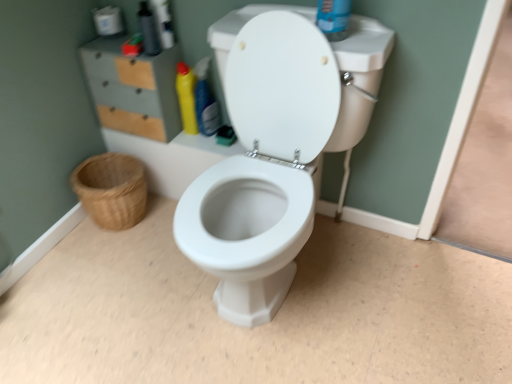
The image size is (512, 384). What do you see at coordinates (206, 101) in the screenshot?
I see `yellow glossy bottle at center, positioned as the 1th cleaning product in right-to-left order` at bounding box center [206, 101].

What do you see at coordinates (186, 97) in the screenshot? The height and width of the screenshot is (384, 512). I see `yellow plastic bottle at upper left, the 1th cleaning product viewed from the left` at bounding box center [186, 97].

This screenshot has width=512, height=384. In order to click on yellow plastic bottle at upper left, which is the 2th cleaning product in right-to-left order in this screenshot , I will do `click(186, 97)`.

Where is `translucent plastic bottle at upper left`? translucent plastic bottle at upper left is located at coordinates (148, 30).

From the picture: Measure the distance between white matte toilet paper at upper left and camera.

A distance of 4.91 feet exists between white matte toilet paper at upper left and camera.

Where is `woven natural basket at lower left`? This screenshot has height=384, width=512. woven natural basket at lower left is located at coordinates (112, 190).

Which of these two, white matte toilet paper at upper left or yellow glossy bottle at center, which is the 2th cleaning product in left-to-right order, is thinner?

yellow glossy bottle at center, which is the 2th cleaning product in left-to-right order, is thinner.

Which object is further away from the camera, white matte toilet paper at upper left or yellow glossy bottle at center, positioned as the 1th cleaning product in right-to-left order?

white matte toilet paper at upper left.

Would you say white matte toilet paper at upper left is outside yellow glossy bottle at center, which is the 2th cleaning product in left-to-right order?

white matte toilet paper at upper left lies outside yellow glossy bottle at center, which is the 2th cleaning product in left-to-right order,'s area.

From the image's perspective, which one is positioned higher, matte gray/file cabinet at upper left or yellow plastic bottle at upper left, the 1th cleaning product viewed from the left?

matte gray/file cabinet at upper left, from the image's perspective.

Is matte gray/file cabinet at upper left situated inside yellow plastic bottle at upper left, the 1th cleaning product viewed from the left, or outside?

matte gray/file cabinet at upper left lies outside yellow plastic bottle at upper left, the 1th cleaning product viewed from the left.

Consider the image. Which is further, (93, 68) or (187, 105)?

The point (187, 105) is farther from the camera.

Considering the points (201, 97) and (133, 89), which point is behind, point (201, 97) or point (133, 89)?

The point (201, 97) is more distant.

Measure the distance between yellow glossy bottle at center, which is the 2th cleaning product in left-to-right order, and matte gray/file cabinet at upper left.

yellow glossy bottle at center, which is the 2th cleaning product in left-to-right order, and matte gray/file cabinet at upper left are 8.41 inches apart.

From a real-world perspective, is yellow glossy bottle at center, which is the 2th cleaning product in left-to-right order, located higher than matte gray/file cabinet at upper left?

No, from a real-world perspective, yellow glossy bottle at center, which is the 2th cleaning product in left-to-right order, is not above matte gray/file cabinet at upper left.

Could you tell me if yellow glossy bottle at center, which is the 2th cleaning product in left-to-right order, is facing matte gray/file cabinet at upper left?

No, yellow glossy bottle at center, which is the 2th cleaning product in left-to-right order, is not facing towards matte gray/file cabinet at upper left.

Is matte gray/file cabinet at upper left aimed at white matte toilet paper at upper left?

No, matte gray/file cabinet at upper left is not facing towards white matte toilet paper at upper left.

Relative to white matte toilet paper at upper left, is matte gray/file cabinet at upper left in front or behind?

In the image, matte gray/file cabinet at upper left appears in front of white matte toilet paper at upper left.

Looking at their sizes, would you say matte gray/file cabinet at upper left is wider or thinner than white matte toilet paper at upper left?

Considering their sizes, matte gray/file cabinet at upper left looks broader than white matte toilet paper at upper left.

Is matte gray/file cabinet at upper left spatially inside white matte toilet paper at upper left, or outside of it?

matte gray/file cabinet at upper left cannot be found inside white matte toilet paper at upper left.

Is woven natural basket at lower left not near translucent plastic bottle at upper left?

No, there isn't a large distance between woven natural basket at lower left and translucent plastic bottle at upper left.

Which object is positioned more to the left, woven natural basket at lower left or translucent plastic bottle at upper left?

Positioned to the left is woven natural basket at lower left.

Is woven natural basket at lower left facing towards translucent plastic bottle at upper left?

No, woven natural basket at lower left does not turn towards translucent plastic bottle at upper left.

Is point (153, 34) farther from viewer compared to point (187, 130)?

No, (153, 34) is in front of (187, 130).

From the image's perspective, is translucent plastic bottle at upper left under yellow plastic bottle at upper left, the 1th cleaning product viewed from the left?

Actually, translucent plastic bottle at upper left appears above yellow plastic bottle at upper left, the 1th cleaning product viewed from the left, in the image.

Does translucent plastic bottle at upper left touch yellow plastic bottle at upper left, the 1th cleaning product viewed from the left?

No, translucent plastic bottle at upper left is not in contact with yellow plastic bottle at upper left, the 1th cleaning product viewed from the left.

From the picture: Relative to yellow plastic bottle at upper left, which is the 2th cleaning product in right-to-left order, is translucent plastic bottle at upper left in front or behind?

In the image, translucent plastic bottle at upper left appears in front of yellow plastic bottle at upper left, which is the 2th cleaning product in right-to-left order.

In the scene shown: From their relative heights in the image, would you say matte gray/file cabinet at upper left is taller or shorter than yellow glossy bottle at center, which is the 2th cleaning product in left-to-right order?

matte gray/file cabinet at upper left is taller than yellow glossy bottle at center, which is the 2th cleaning product in left-to-right order.

From the image's perspective, which one is positioned lower, matte gray/file cabinet at upper left or yellow glossy bottle at center, which is the 2th cleaning product in left-to-right order?

From the image's view, yellow glossy bottle at center, which is the 2th cleaning product in left-to-right order, is below.

Considering the relative positions of matte gray/file cabinet at upper left and yellow glossy bottle at center, positioned as the 1th cleaning product in right-to-left order, in the image provided, is matte gray/file cabinet at upper left to the left or to the right of yellow glossy bottle at center, positioned as the 1th cleaning product in right-to-left order,?

Clearly, matte gray/file cabinet at upper left is on the left of yellow glossy bottle at center, positioned as the 1th cleaning product in right-to-left order, in the image.

Could you measure the distance between matte gray/file cabinet at upper left and yellow glossy bottle at center, which is the 2th cleaning product in left-to-right order?

matte gray/file cabinet at upper left is 8.41 inches away from yellow glossy bottle at center, which is the 2th cleaning product in left-to-right order.

Identify the location of toilet paper on the left of yellow glossy bottle at center, positioned as the 1th cleaning product in right-to-left order. This screenshot has width=512, height=384. (108, 21).

At what (x,y) coordinates should I click in order to perform the action: click on file cabinet above the yellow plastic bottle at upper left, which is the 2th cleaning product in right-to-left order (from the image's perspective). Please return your answer as a coordinate pair (x, y). Looking at the image, I should click on [133, 89].

Based on their spatial positions, is translucent plastic bottle at upper left or yellow glossy bottle at center, positioned as the 1th cleaning product in right-to-left order, closer to white matte toilet paper at upper left?

translucent plastic bottle at upper left.

Considering their positions, is yellow glossy bottle at center, positioned as the 1th cleaning product in right-to-left order, positioned closer to white matte toilet paper at upper left than matte gray/file cabinet at upper left?

Among the two, matte gray/file cabinet at upper left is located nearer to white matte toilet paper at upper left.

Which object lies nearer to the anchor point woven natural basket at lower left, yellow plastic bottle at upper left, the 1th cleaning product viewed from the left, or white matte toilet paper at upper left?

Based on the image, yellow plastic bottle at upper left, the 1th cleaning product viewed from the left, appears to be nearer to woven natural basket at lower left.

Which object lies nearer to the anchor point translucent plastic bottle at upper left, yellow plastic bottle at upper left, the 1th cleaning product viewed from the left, or matte gray/file cabinet at upper left?

Among the two, matte gray/file cabinet at upper left is located nearer to translucent plastic bottle at upper left.

When comparing their distances from woven natural basket at lower left, does white matte toilet paper at upper left or matte gray/file cabinet at upper left seem further?

The object further to woven natural basket at lower left is white matte toilet paper at upper left.

Estimate the real-world distances between objects in this image. Which object is closer to translucent plastic bottle at upper left, white matte toilet paper at upper left or yellow plastic bottle at upper left, the 1th cleaning product viewed from the left?

Based on the image, white matte toilet paper at upper left appears to be nearer to translucent plastic bottle at upper left.

From the image, which object appears to be farther from white matte toilet paper at upper left, yellow glossy bottle at center, positioned as the 1th cleaning product in right-to-left order, or translucent plastic bottle at upper left?

yellow glossy bottle at center, positioned as the 1th cleaning product in right-to-left order.

Based on their spatial positions, is matte gray/file cabinet at upper left or yellow glossy bottle at center, positioned as the 1th cleaning product in right-to-left order, closer to woven natural basket at lower left?

Based on the image, matte gray/file cabinet at upper left appears to be nearer to woven natural basket at lower left.

Image resolution: width=512 pixels, height=384 pixels. Find the location of `toiletry between white matte toilet paper at upper left and yellow plastic bottle at upper left, the 1th cleaning product viewed from the left, vertically`. toiletry between white matte toilet paper at upper left and yellow plastic bottle at upper left, the 1th cleaning product viewed from the left, vertically is located at coordinates (148, 30).

Find the location of a particular element. file cabinet that lies between translucent plastic bottle at upper left and woven natural basket at lower left from top to bottom is located at coordinates (133, 89).

Locate an element on the screen. The image size is (512, 384). toiletry located between white matte toilet paper at upper left and yellow glossy bottle at center, positioned as the 1th cleaning product in right-to-left order, in the left-right direction is located at coordinates (148, 30).

Find the location of a particular element. This screenshot has height=384, width=512. toiletry between white matte toilet paper at upper left and matte gray/file cabinet at upper left in the vertical direction is located at coordinates (148, 30).